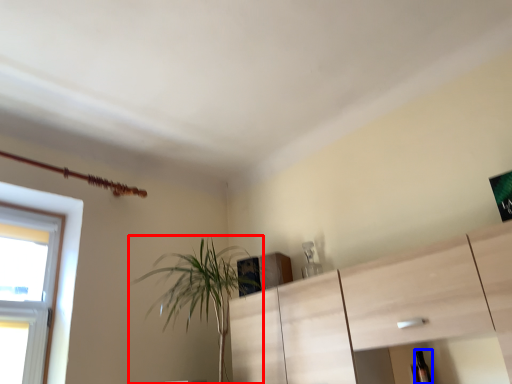
Question: Which object appears closest to the camera in this image, houseplant (highlighted by a red box) or bottle (highlighted by a blue box)?

Choices:
 (A) houseplant
 (B) bottle

Answer: (A)